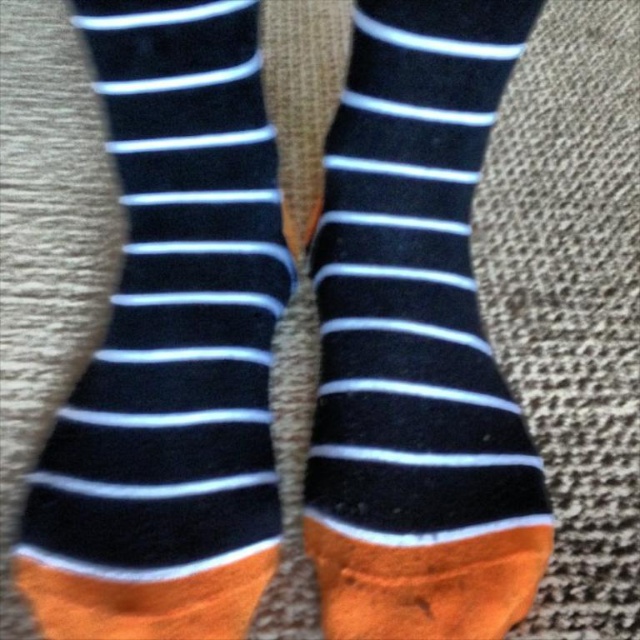
You are a fashion designer analyzing a closeup image of socks. The socks have horizontal stripes and orange at the toes. You need to place a small logo exactly at point (x=170, y=346). Based on the image, what color should the logo be to match the socks?

The point (x=170, y=346) corresponds to matte black and orange socks at center, so the logo should be either black or orange to match the socks.